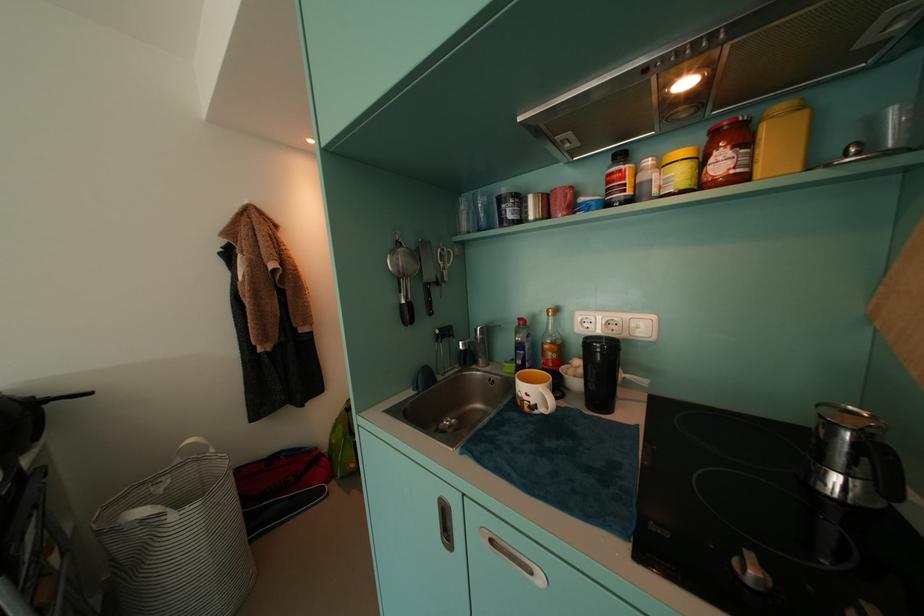
Where would you pull the laundry basket handle? Please return your answer as a coordinate pair (x, y).

(178, 540)